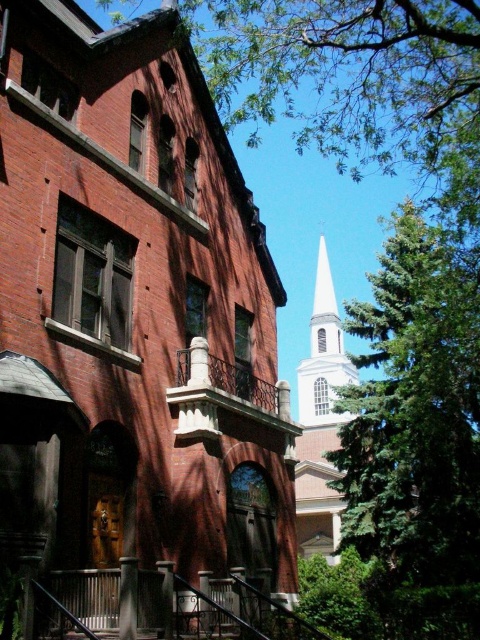
Who is lower down, white steeple at upper center or green leafy tree at upper center?

white steeple at upper center is below.

This screenshot has width=480, height=640. What do you see at coordinates (132, 310) in the screenshot?
I see `white steeple at upper center` at bounding box center [132, 310].

The image size is (480, 640). Find the location of `white steeple at upper center`. white steeple at upper center is located at coordinates (132, 310).

Does green leafy tree at right have a smaller size compared to white smooth steeple at upper center?

Yes, green leafy tree at right is smaller than white smooth steeple at upper center.

Does green leafy tree at right appear over white smooth steeple at upper center?

Yes, green leafy tree at right is above white smooth steeple at upper center.

Between point (476, 284) and point (307, 509), which one is positioned in front?

Point (476, 284)

Where is `green leafy tree at right`? Image resolution: width=480 pixels, height=640 pixels. green leafy tree at right is located at coordinates (415, 410).

The width and height of the screenshot is (480, 640). Describe the element at coordinates (132, 310) in the screenshot. I see `white steeple at upper center` at that location.

Between white steeple at upper center and green leafy tree at right, which one has less height?

With less height is green leafy tree at right.

Is point (152, 408) in front of point (437, 556)?

Yes.

Find the location of a particular element. This screenshot has height=640, width=480. white steeple at upper center is located at coordinates (132, 310).